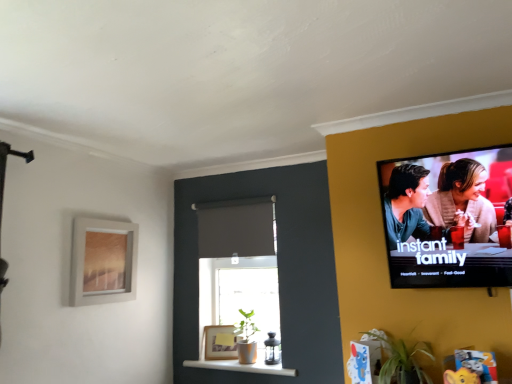
Question: Does green leafy plant at lower right appear on the right side of matte silver picture frame at upper left, arranged as the 1th picture frame when viewed from the front?

Choices:
 (A) no
 (B) yes

Answer: (B)

Question: Is green leafy plant at lower right positioned with its back to matte silver picture frame at upper left, which is the first picture frame in left-to-right order?

Choices:
 (A) yes
 (B) no

Answer: (B)

Question: Is green leafy plant at lower right closer to camera compared to matte silver picture frame at upper left, arranged as the 1th picture frame when viewed from the front?

Choices:
 (A) no
 (B) yes

Answer: (B)

Question: Considering the relative sizes of green leafy plant at lower right and matte silver picture frame at upper left, arranged as the second picture frame when viewed from the back, in the image provided, is green leafy plant at lower right bigger than matte silver picture frame at upper left, arranged as the second picture frame when viewed from the back,?

Choices:
 (A) no
 (B) yes

Answer: (A)

Question: Does green leafy plant at lower right come behind matte silver picture frame at upper left, marked as the second picture frame in a bottom-to-top arrangement?

Choices:
 (A) yes
 (B) no

Answer: (B)

Question: Is matte gray curtain at center wider or thinner than matte gold picture frame at lower center, arranged as the 2th picture frame when viewed from the left?

Choices:
 (A) wide
 (B) thin

Answer: (B)

Question: Is matte gray curtain at center taller or shorter than matte gold picture frame at lower center, marked as the 1th picture frame in a back-to-front arrangement?

Choices:
 (A) tall
 (B) short

Answer: (A)

Question: Is matte gray curtain at center bigger or smaller than matte gold picture frame at lower center, arranged as the 2th picture frame when viewed from the left?

Choices:
 (A) small
 (B) big

Answer: (B)

Question: From a real-world perspective, relative to matte gold picture frame at lower center, which is the second picture frame from front to back, is matte gray curtain at center vertically above or below?

Choices:
 (A) above
 (B) below

Answer: (A)

Question: From the image's perspective, is matte silver picture frame at upper left, marked as the second picture frame in a bottom-to-top arrangement, located above or below matte gray curtain at center?

Choices:
 (A) above
 (B) below

Answer: (B)

Question: Relative to matte gray curtain at center, is matte silver picture frame at upper left, arranged as the second picture frame when viewed from the back, in front or behind?

Choices:
 (A) behind
 (B) front

Answer: (B)

Question: In terms of width, does matte silver picture frame at upper left, arranged as the 1th picture frame when viewed from the front, look wider or thinner when compared to matte gray curtain at center?

Choices:
 (A) wide
 (B) thin

Answer: (A)

Question: Is point (115, 251) closer or farther from the camera than point (257, 215)?

Choices:
 (A) closer
 (B) farther

Answer: (A)

Question: Would you say green leafy plant at lower right is to the left or to the right of matte gray curtain at center in the picture?

Choices:
 (A) left
 (B) right

Answer: (B)

Question: Looking at their shapes, would you say green leafy plant at lower right is wider or thinner than matte gray curtain at center?

Choices:
 (A) wide
 (B) thin

Answer: (A)